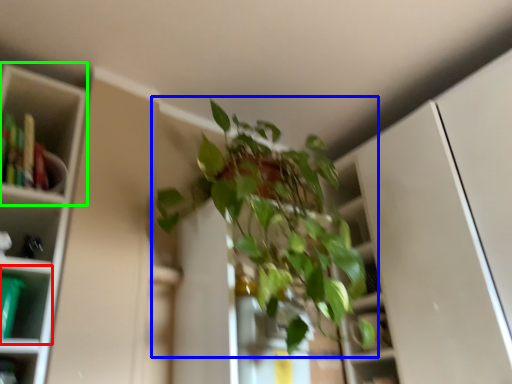
Question: Which object is positioned farthest from shelf (highlighted by a red box)? Select from houseplant (highlighted by a blue box) and cabinet (highlighted by a green box).

Choices:
 (A) houseplant
 (B) cabinet

Answer: (A)